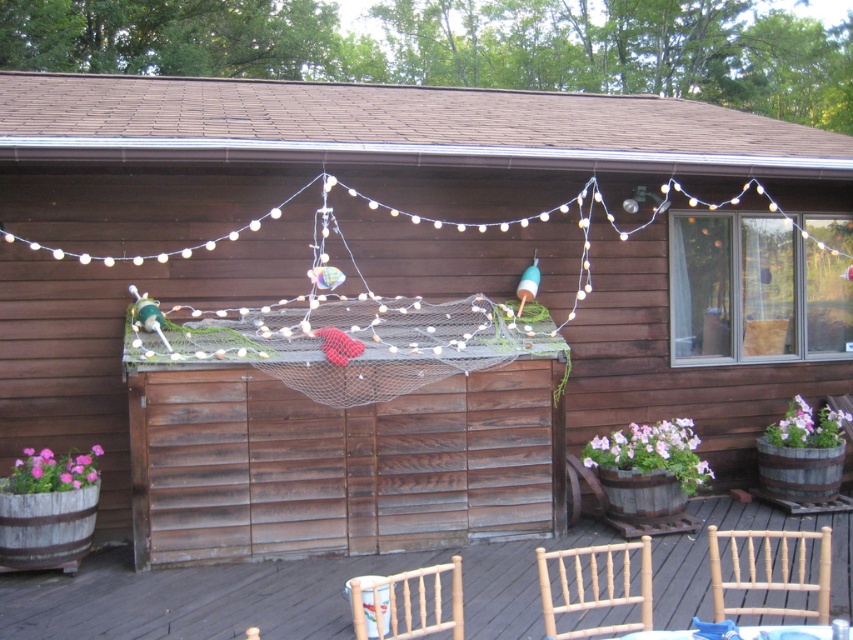
Who is more distant from viewer, (268,596) or (827,566)?

Point (268,596)

Is point (247, 572) farther from camera compared to point (769, 577)?

Yes.

The image size is (853, 640). Identify the location of wooden chairs at lower center. (268, 595).

Does wooden chairs at lower center appear under white plastic table at lower center?

Yes, wooden chairs at lower center is below white plastic table at lower center.

Does point (514, 586) lie in front of point (790, 632)?

No, (514, 586) is further to viewer.

Where is `wooden chairs at lower center`? wooden chairs at lower center is located at coordinates (268, 595).

Does light brown wooden chair at lower right have a lesser width compared to light brown wooden chair at lower center?

In fact, light brown wooden chair at lower right might be wider than light brown wooden chair at lower center.

Can you confirm if light brown wooden chair at lower right is smaller than light brown wooden chair at lower center?

Indeed, light brown wooden chair at lower right has a smaller size compared to light brown wooden chair at lower center.

Measure the distance between light brown wooden chair at lower right and camera.

light brown wooden chair at lower right is 4.03 meters away from camera.

Locate an element on the screen. Image resolution: width=853 pixels, height=640 pixels. light brown wooden chair at lower right is located at coordinates (770, 572).